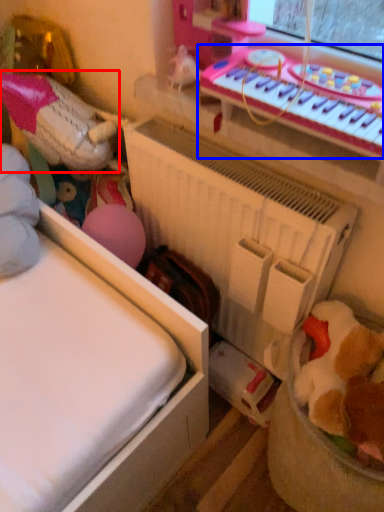
Question: Among these objects, which one is nearest to the camera, toy (highlighted by a red box) or musical keyboard (highlighted by a blue box)?

Choices:
 (A) toy
 (B) musical keyboard

Answer: (B)